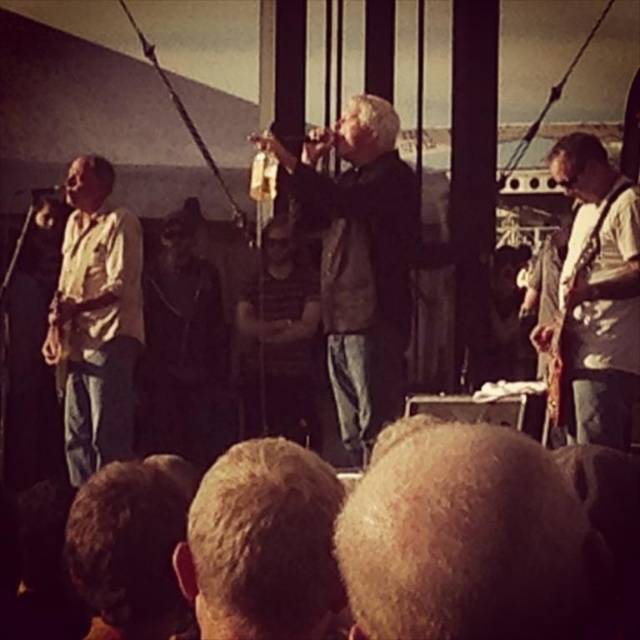
Between point (300, 513) and point (97, 280), which one is positioned behind?

Positioned behind is point (97, 280).

Is gray hair at center further to the viewer compared to light brown shirt at left?

No, it is not.

Locate an element on the screen. gray hair at center is located at coordinates (262, 545).

Can you confirm if light brown shirt at left is shorter than white matte guitar at right?

No, light brown shirt at left is not shorter than white matte guitar at right.

Does point (120, 339) come in front of point (621, 243)?

No, it is behind (621, 243).

Find the location of a particular element. light brown shirt at left is located at coordinates (97, 320).

Does light brown hair at center have a lesser height compared to gray hair at center?

No.

Does light brown hair at center have a smaller size compared to gray hair at center?

Incorrect, light brown hair at center is not smaller in size than gray hair at center.

The image size is (640, 640). Identify the location of light brown hair at center. (468, 540).